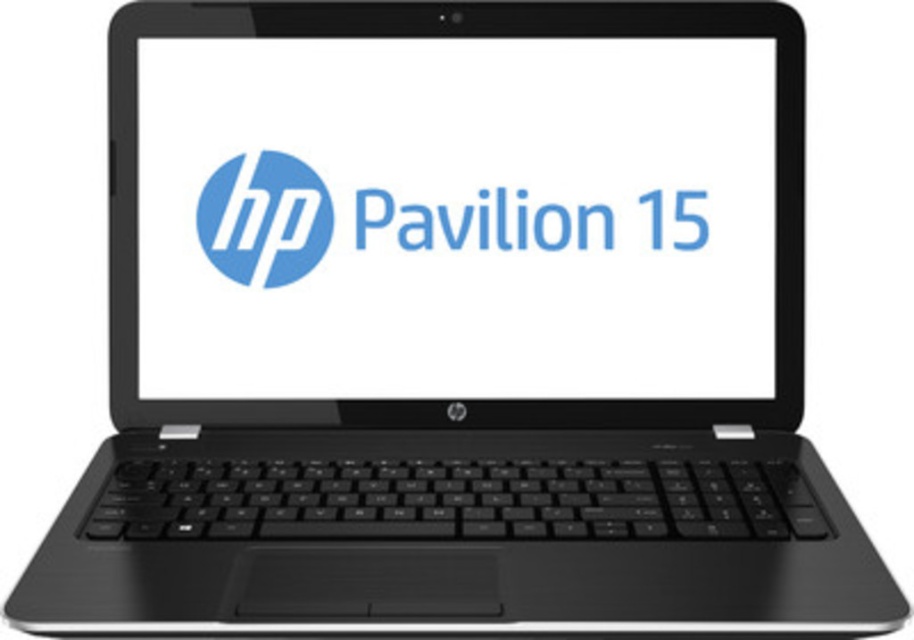
Question: Does matte black laptop at center have a larger size compared to matte blue circle at center?

Choices:
 (A) no
 (B) yes

Answer: (B)

Question: Can you confirm if matte black laptop at center is positioned above matte blue circle at center?

Choices:
 (A) no
 (B) yes

Answer: (A)

Question: Which of the following is the closest to the observer?

Choices:
 (A) (711, 220)
 (B) (310, 236)

Answer: (A)

Question: Can you confirm if matte black laptop at center is positioned below matte blue circle at center?

Choices:
 (A) yes
 (B) no

Answer: (A)